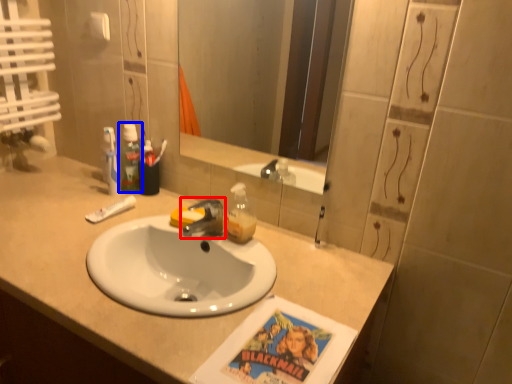
Question: Which object is closer to the camera taking this photo, tap (highlighted by a red box) or mouthwash (highlighted by a blue box)?

Choices:
 (A) tap
 (B) mouthwash

Answer: (A)